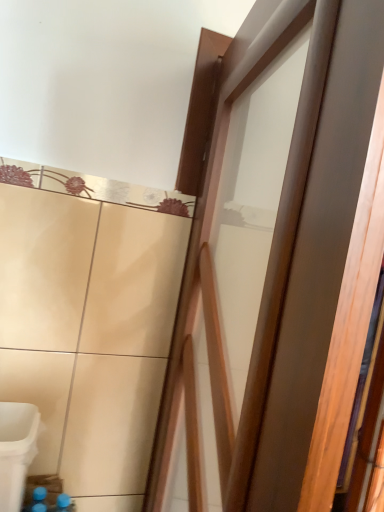
Question: Should I look upward or downward to see white plastic potty at lower left?

Choices:
 (A) up
 (B) down

Answer: (B)